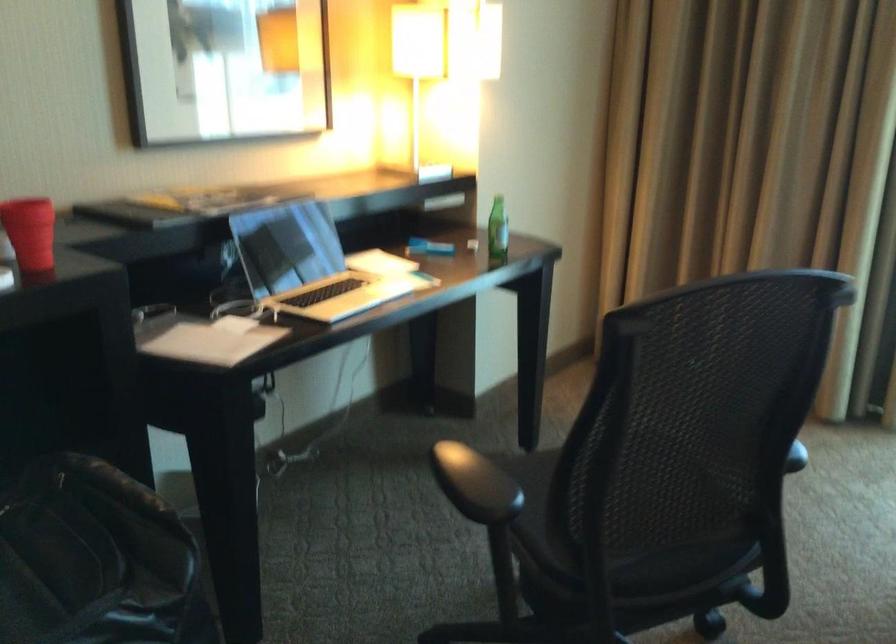
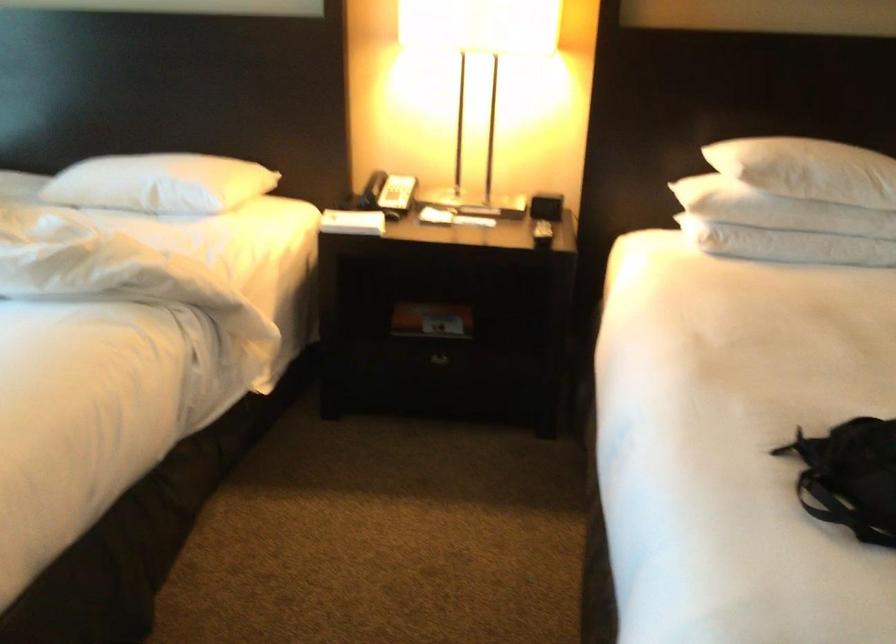
Based on the continuous images, in which direction is the camera rotating?

The camera's rotation is toward right-down.